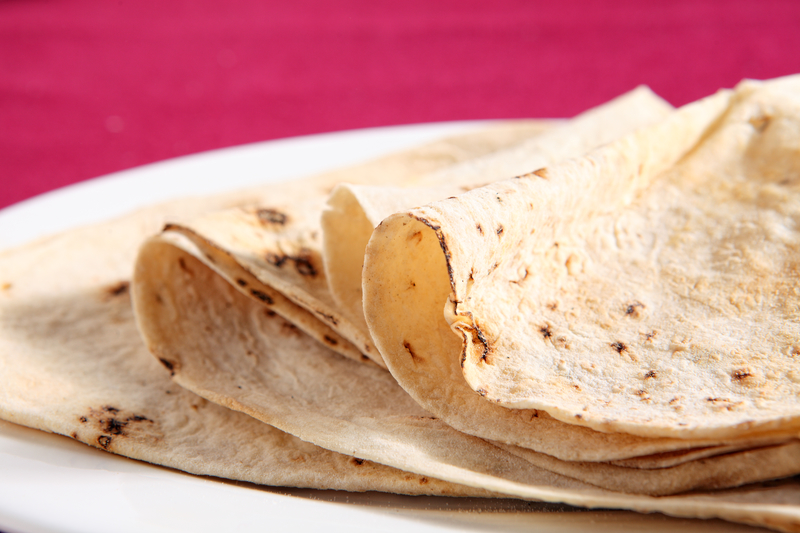
Locate an element on the screen. This screenshot has height=533, width=800. plate is located at coordinates (66, 242).